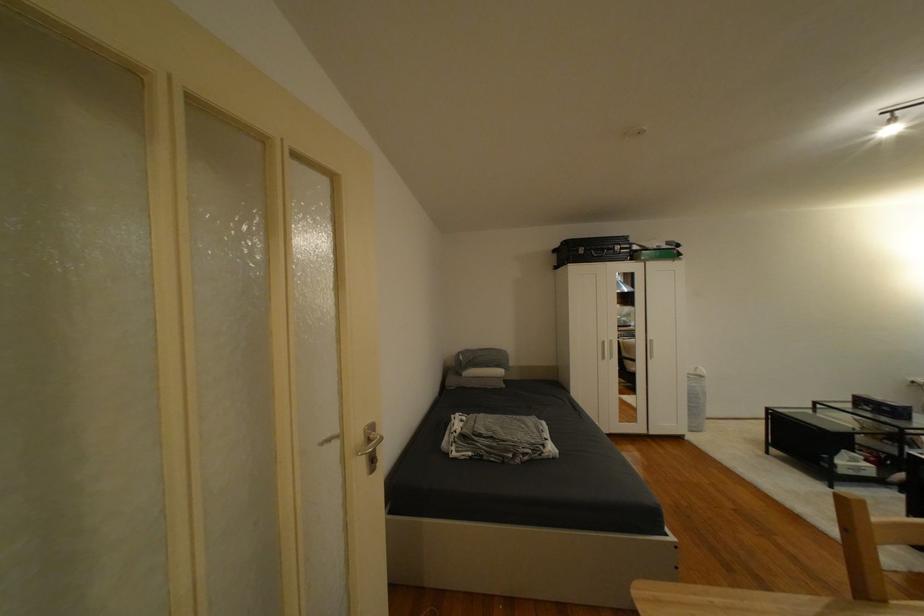
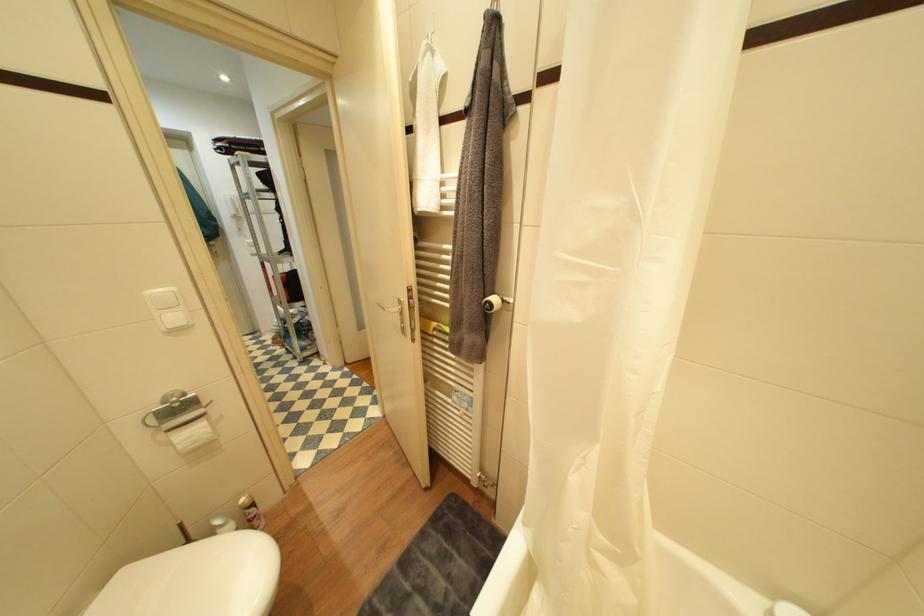
Question: I am providing you with two images of the same scene from different viewpoints. Which of the following objects are not visible in image2?

Choices:
 (A) black suitcase
 (B) toilet paper holder
 (C) silver door handle
 (D) black stool sitting surface

Answer: (A)